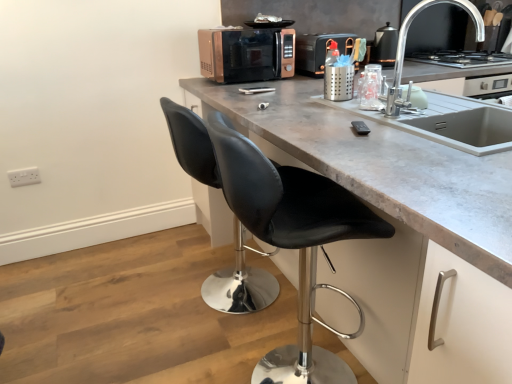
Image resolution: width=512 pixels, height=384 pixels. Find the location of `free space in front of black leather swivel chair at center`. free space in front of black leather swivel chair at center is located at coordinates (202, 343).